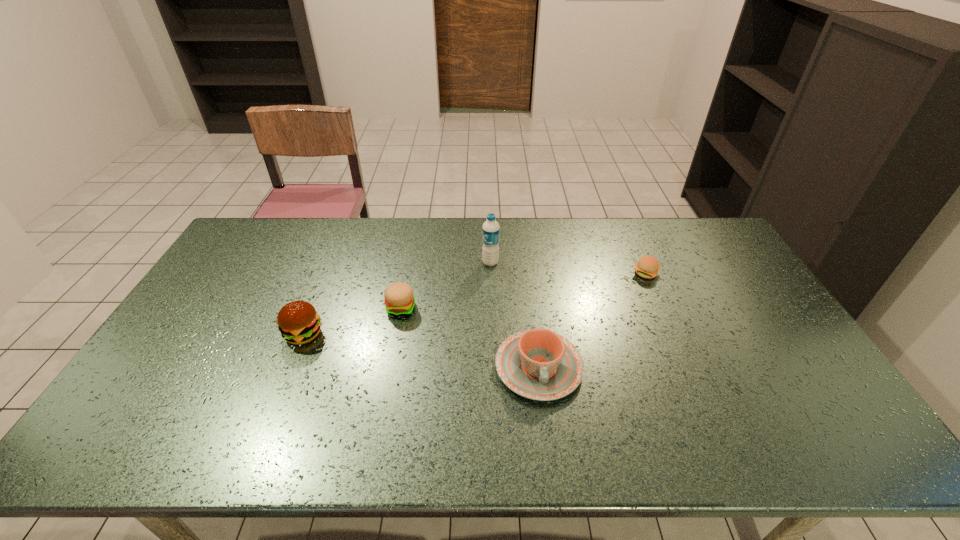
Where is `the second closest hamburger relative to the chinaware`? the second closest hamburger relative to the chinaware is located at coordinates (647, 267).

You are a GUI agent. You are given a task and a screenshot of the screen. Output one action in this format:
    pyautogui.click(x=<x>, y=<y>)
    Task: Click on the vacant point that satisfies the following two spatial constraints: 1. on the label of the tallest object; 2. on the left side of the rightmost object
    This screenshot has height=540, width=960.
    Given the screenshot: What is the action you would take?
    pyautogui.click(x=491, y=273)

You are a GUI agent. You are given a task and a screenshot of the screen. Output one action in this format:
    pyautogui.click(x=<x>, y=<y>)
    Task: Click on the vacant space that satisfies the following two spatial constraints: 1. on the label of the water bottle; 2. on the left side of the shortest hamburger
    
    Given the screenshot: What is the action you would take?
    pyautogui.click(x=491, y=273)